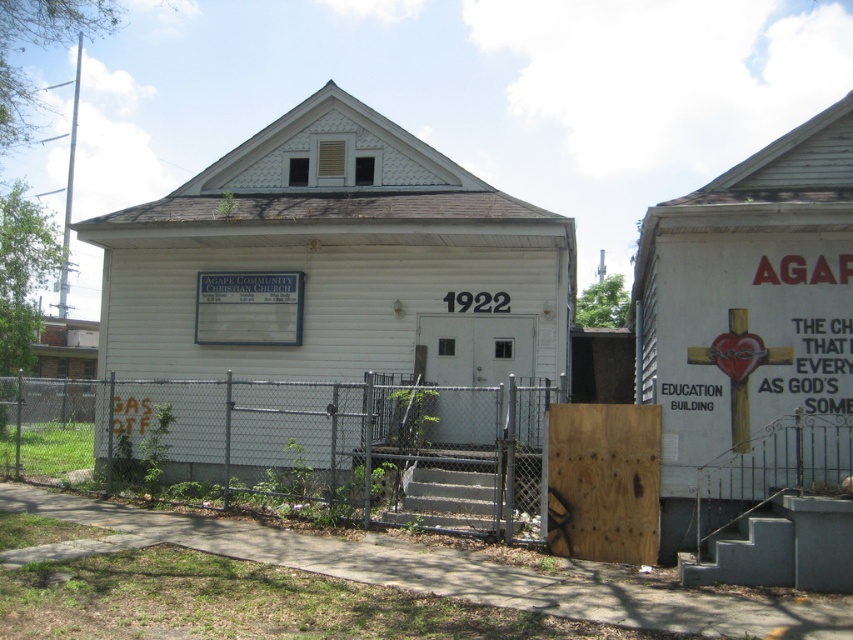
Question: Among these points, which one is nearest to the camera?

Choices:
 (A) (494, 433)
 (B) (279, 301)
 (C) (712, 356)

Answer: (C)

Question: Based on their relative distances, which object is farther from the white matte sign at center?

Choices:
 (A) gray chain-link fence at lower left
 (B) red painted heart at center

Answer: (B)

Question: Where is white matte sign at center located in relation to red painted heart at center in the image?

Choices:
 (A) below
 (B) above

Answer: (B)

Question: Which point is closer to the camera?

Choices:
 (A) (221, 328)
 (B) (741, 360)

Answer: (B)

Question: Is white matte sign at center thinner than red painted heart at center?

Choices:
 (A) yes
 (B) no

Answer: (B)

Question: Can you confirm if gray chain-link fence at lower left is positioned to the right of white matte sign at center?

Choices:
 (A) no
 (B) yes

Answer: (B)